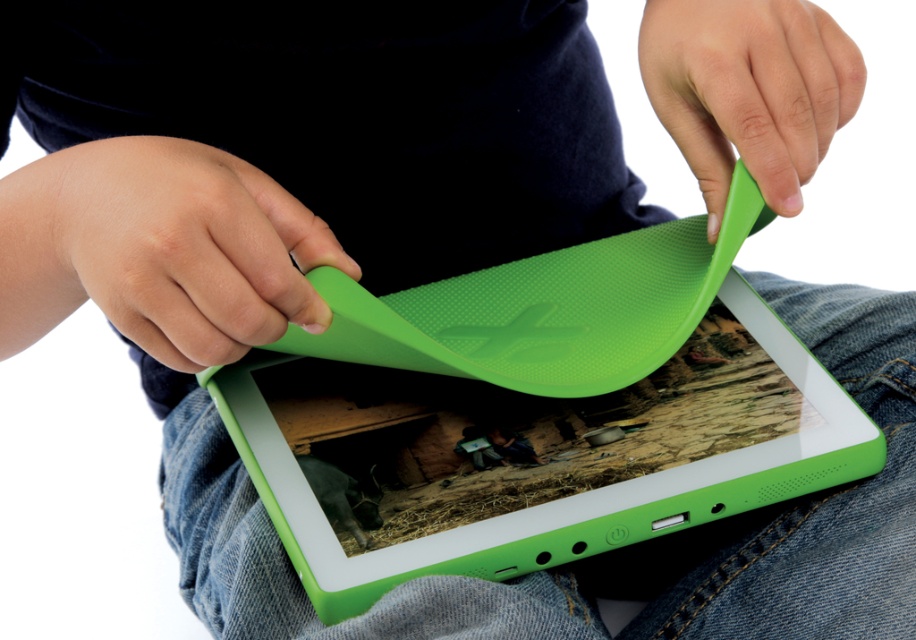
Is green rubber tablet at center wider than green matte tablet cover at upper left?

Yes.

What are the coordinates of `green rubber tablet at center` in the screenshot? It's located at (544, 449).

This screenshot has height=640, width=916. What do you see at coordinates (544, 449) in the screenshot?
I see `green rubber tablet at center` at bounding box center [544, 449].

The height and width of the screenshot is (640, 916). Find the location of `green rubber tablet at center`. green rubber tablet at center is located at coordinates (544, 449).

From the picture: Can you confirm if green matte tablet cover at upper left is positioned to the right of green matte/silicone handle at upper right?

No, green matte tablet cover at upper left is not to the right of green matte/silicone handle at upper right.

Based on the photo, who is positioned more to the right, green matte tablet cover at upper left or green matte/silicone handle at upper right?

Positioned to the right is green matte/silicone handle at upper right.

Where is `green matte tablet cover at upper left`? This screenshot has width=916, height=640. green matte tablet cover at upper left is located at coordinates (161, 248).

The image size is (916, 640). What are the coordinates of `green matte tablet cover at upper left` in the screenshot? It's located at (161, 248).

Is green rubber tablet at center further to camera compared to green matte/silicone handle at upper right?

No, it is not.

Which of these two, green rubber tablet at center or green matte/silicone handle at upper right, stands taller?

green rubber tablet at center is taller.

Which is in front, point (555, 502) or point (804, 8)?

Positioned in front is point (555, 502).

I want to click on green rubber tablet at center, so click(x=544, y=449).